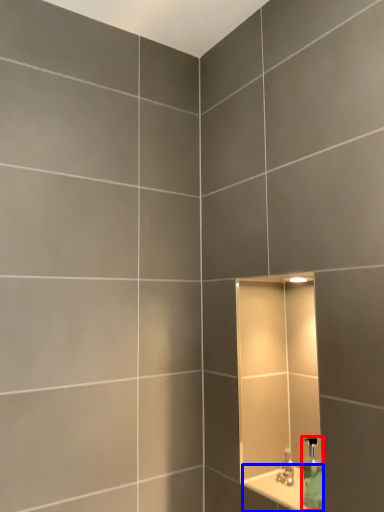
Question: Which of the following is the farthest to the observer, soap dispenser (highlighted by a red box) or ledge (highlighted by a blue box)?

Choices:
 (A) soap dispenser
 (B) ledge

Answer: (A)